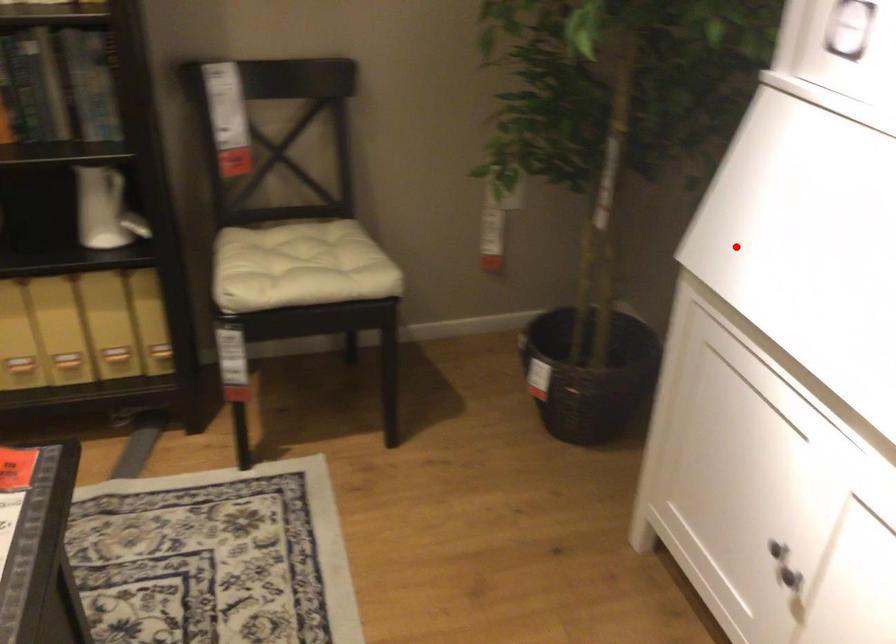
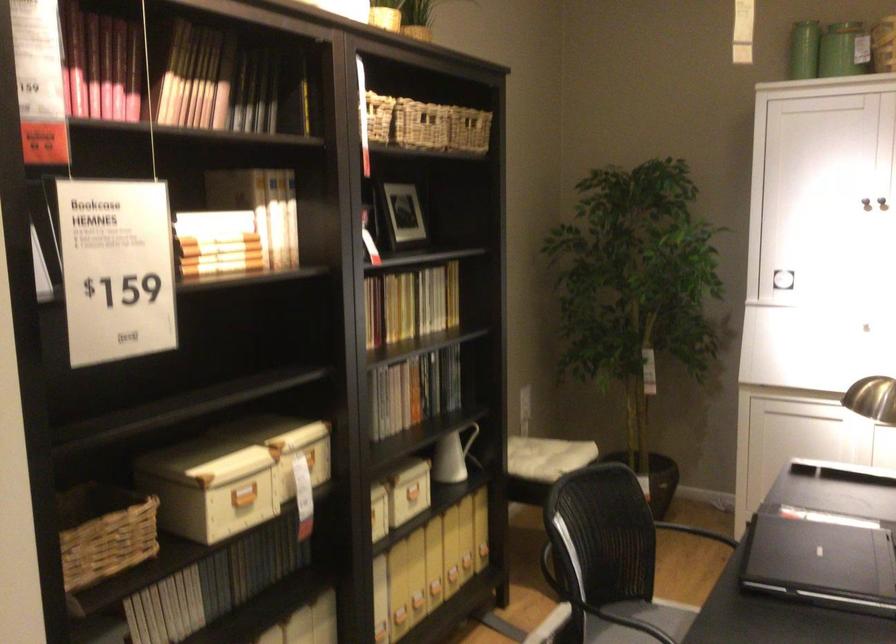
Question: I am providing you with two images of the same scene from different viewpoints. Given a red point in image1, look at the same physical point in image2. Is it:

Choices:
 (A) Closer to the viewpoint
 (B) Farther from the viewpoint

Answer: (B)